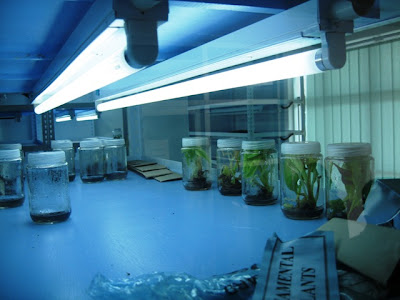
This screenshot has width=400, height=300. Find the location of `shelf`. shelf is located at coordinates (250, 115), (49, 132).